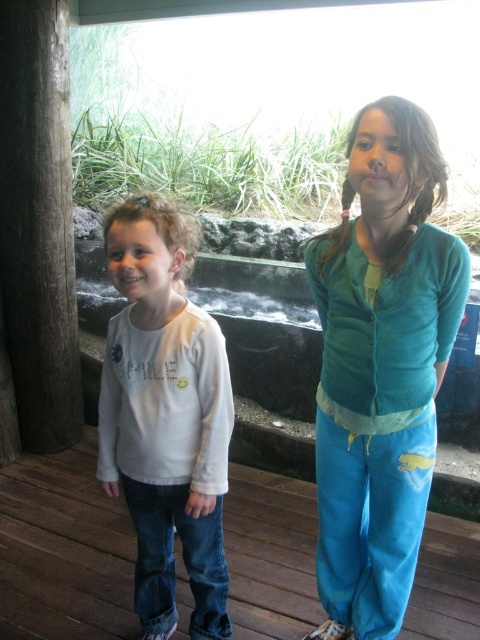
Based on the photo, you are a photographer trying to capture a photo of the wooden deck at center and the white cotton shirt at left. Which object should you focus on first if you want to ensure both are in the frame without moving the camera?

The wooden deck at center is larger in size than the white cotton shirt at left, so you should focus on the wooden deck at center first to ensure it fits within the frame before adjusting for the smaller white cotton shirt at left.

You are a photographer taking a picture of the teal cardigan at center and the white cotton shirt at left. Based on their positions, which one is closer to the top of the frame?

The teal cardigan at center is located above the white cotton shirt at left, so it is closer to the top of the frame.